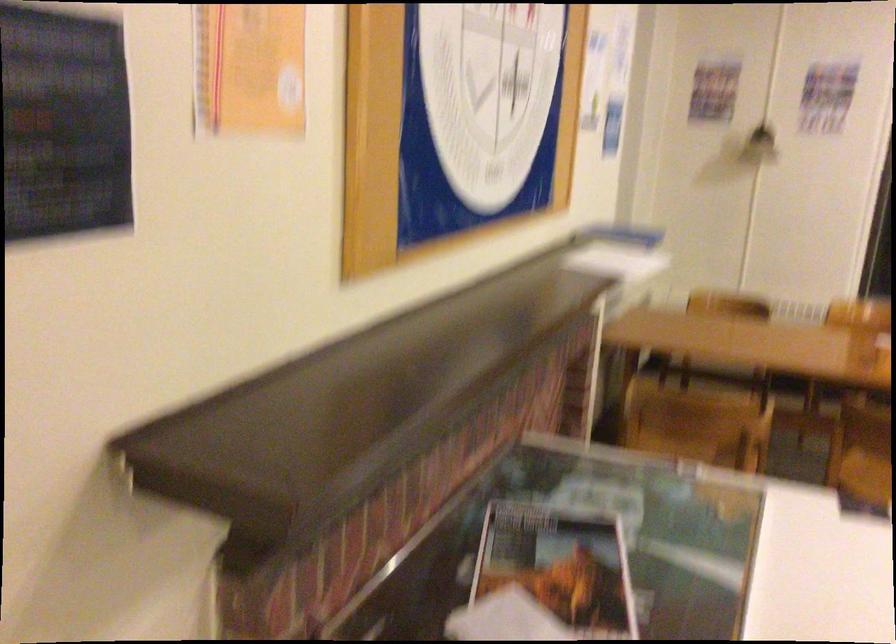
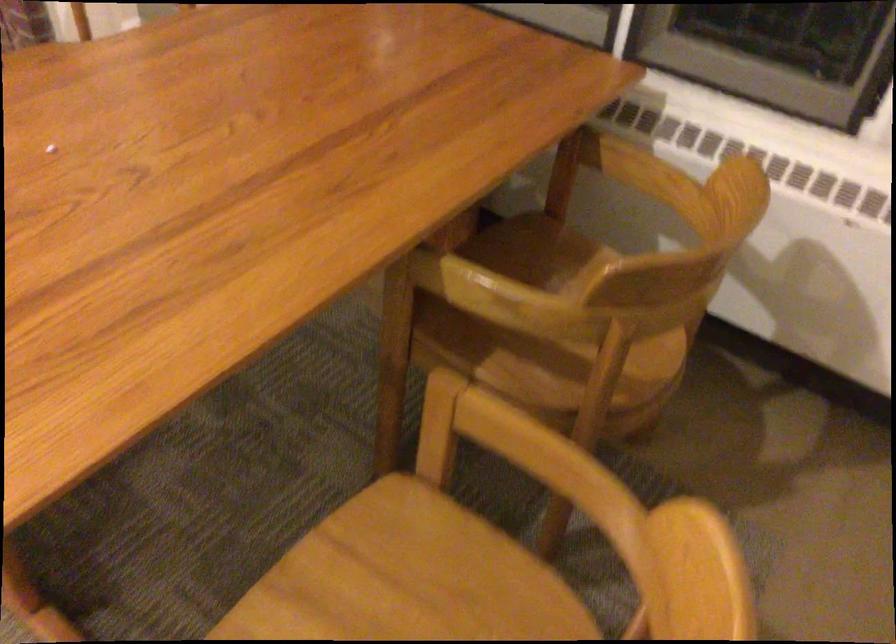
Find the pixel in the second image that matches point (789, 310) in the first image.

(501, 440)